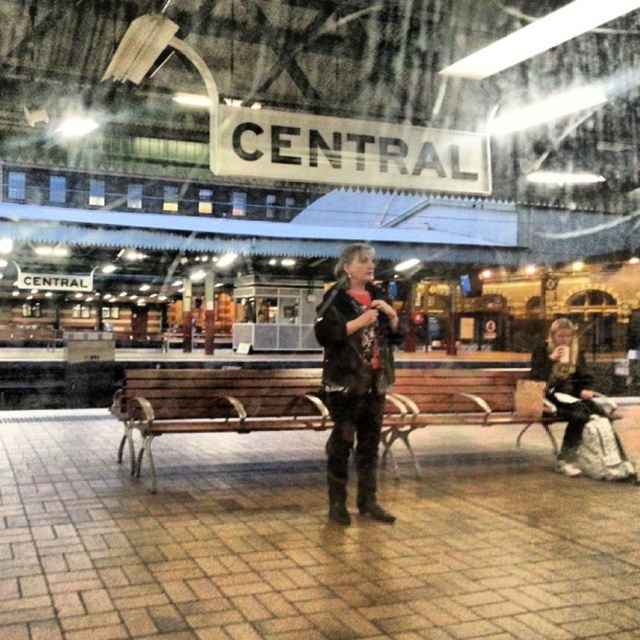
Question: Can you confirm if brown wooden bench at center is positioned to the left of leather jacket at center?

Choices:
 (A) no
 (B) yes

Answer: (B)

Question: Can you confirm if brown wooden bench at center is smaller than leather jacket at center?

Choices:
 (A) yes
 (B) no

Answer: (A)

Question: Which point is farther from the camera taking this photo?

Choices:
 (A) (330, 406)
 (B) (113, 413)

Answer: (B)

Question: Which point is closer to the camera taking this photo?

Choices:
 (A) (376, 468)
 (B) (134, 417)

Answer: (A)

Question: Among these objects, which one is farthest from the camera?

Choices:
 (A) leather jacket at center
 (B) brown wooden bench at center

Answer: (B)

Question: Considering the relative positions of brown wooden bench at center and leather jacket at center in the image provided, where is brown wooden bench at center located with respect to leather jacket at center?

Choices:
 (A) above
 (B) below

Answer: (B)